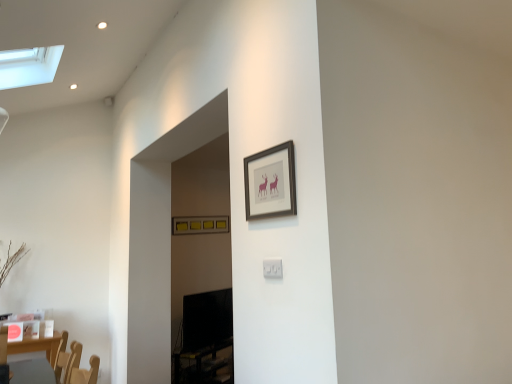
Question: Considering the relative positions of matte yellow picture frame at upper center, which is the second picture frame from right to left, and matte black frame at upper center, which ranks as the first picture frame in top-to-bottom order, in the image provided, is matte yellow picture frame at upper center, which is the second picture frame from right to left, in front of matte black frame at upper center, which ranks as the first picture frame in top-to-bottom order,?

Choices:
 (A) no
 (B) yes

Answer: (A)

Question: From a real-world perspective, is matte yellow picture frame at upper center, which is the 1th picture frame in back-to-front order, physically below matte black frame at upper center, the 2th picture frame in the bottom-to-top sequence?

Choices:
 (A) yes
 (B) no

Answer: (B)

Question: From the image's perspective, is matte yellow picture frame at upper center, the first picture frame from the left, located beneath matte black frame at upper center, which is counted as the 2th picture frame, starting from the back?

Choices:
 (A) yes
 (B) no

Answer: (A)

Question: Is matte yellow picture frame at upper center, which is the second picture frame from right to left, next to matte black frame at upper center, the 2th picture frame when ordered from left to right, and touching it?

Choices:
 (A) yes
 (B) no

Answer: (B)

Question: Can you confirm if matte yellow picture frame at upper center, the first picture frame from the left, is shorter than matte black frame at upper center, the 2th picture frame in the bottom-to-top sequence?

Choices:
 (A) no
 (B) yes

Answer: (B)

Question: Is matte yellow picture frame at upper center, which is the second picture frame in front-to-back order, taller than matte black frame at upper center, which is counted as the 2th picture frame, starting from the back?

Choices:
 (A) yes
 (B) no

Answer: (B)

Question: Considering the relative sizes of white plastic electric outlet at center and matte black frame at upper center, placed as the 1th picture frame when sorted from front to back, in the image provided, is white plastic electric outlet at center wider than matte black frame at upper center, placed as the 1th picture frame when sorted from front to back,?

Choices:
 (A) no
 (B) yes

Answer: (A)

Question: Considering the relative sizes of white plastic electric outlet at center and matte black frame at upper center, the first picture frame from the right, in the image provided, is white plastic electric outlet at center bigger than matte black frame at upper center, the first picture frame from the right,?

Choices:
 (A) yes
 (B) no

Answer: (B)

Question: Is white plastic electric outlet at center taller than matte black frame at upper center, which ranks as the first picture frame in top-to-bottom order?

Choices:
 (A) yes
 (B) no

Answer: (B)

Question: From the image's perspective, is white plastic electric outlet at center above matte black frame at upper center, which ranks as the first picture frame in top-to-bottom order?

Choices:
 (A) yes
 (B) no

Answer: (B)

Question: Can you confirm if white plastic electric outlet at center is positioned to the left of matte black frame at upper center, which ranks as the first picture frame in top-to-bottom order?

Choices:
 (A) no
 (B) yes

Answer: (A)

Question: Is white plastic electric outlet at center positioned before matte black frame at upper center, placed as the 1th picture frame when sorted from front to back?

Choices:
 (A) yes
 (B) no

Answer: (B)

Question: Is matte black frame at upper center, placed as the 1th picture frame when sorted from front to back, closer to camera compared to white plastic electric outlet at center?

Choices:
 (A) no
 (B) yes

Answer: (B)